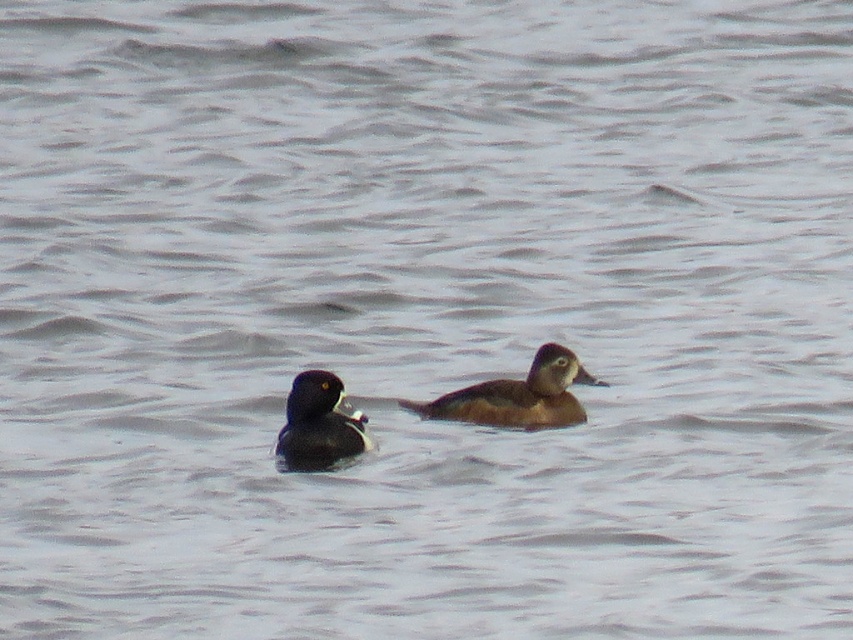
Question: Can you confirm if brown fuzzy duck at center is bigger than brown speckled duck at center?

Choices:
 (A) yes
 (B) no

Answer: (A)

Question: Can you confirm if brown fuzzy duck at center is thinner than brown speckled duck at center?

Choices:
 (A) no
 (B) yes

Answer: (A)

Question: Is brown fuzzy duck at center wider than brown speckled duck at center?

Choices:
 (A) yes
 (B) no

Answer: (A)